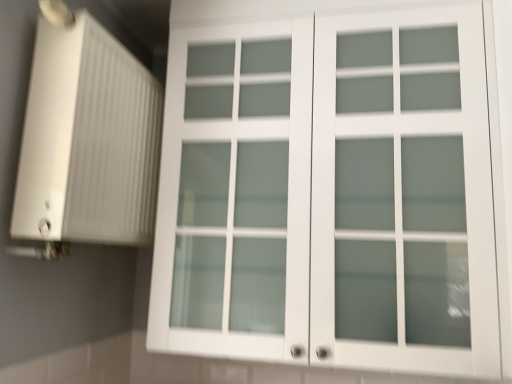
From the picture: What is the approximate width of white ribbed plastic at left?

6.20 inches.

Locate an element on the screen. white ribbed plastic at left is located at coordinates (88, 140).

The height and width of the screenshot is (384, 512). What do you see at coordinates (88, 140) in the screenshot?
I see `white ribbed plastic at left` at bounding box center [88, 140].

Image resolution: width=512 pixels, height=384 pixels. I want to click on white matte cabinet at upper center, so click(328, 186).

The height and width of the screenshot is (384, 512). What do you see at coordinates (328, 186) in the screenshot?
I see `white matte cabinet at upper center` at bounding box center [328, 186].

This screenshot has width=512, height=384. Identify the location of white ribbed plastic at left. (88, 140).

Which is more to the left, white ribbed plastic at left or white matte cabinet at upper center?

Positioned to the left is white ribbed plastic at left.

Between white ribbed plastic at left and white matte cabinet at upper center, which one is positioned behind?

white matte cabinet at upper center is further away from the camera.

Which is farther, [50,124] or [189,296]?

Positioned behind is point [189,296].

Looking at this image, from the image's perspective, which is above, white ribbed plastic at left or white matte cabinet at upper center?

white ribbed plastic at left appears higher in the image.

Looking at this image, from a real-world perspective, is white ribbed plastic at left positioned above or below white matte cabinet at upper center?

In terms of real-world spatial position, white ribbed plastic at left is above white matte cabinet at upper center.

Between white ribbed plastic at left and white matte cabinet at upper center, which one has larger width?

white matte cabinet at upper center is wider.

Is white ribbed plastic at left shorter than white matte cabinet at upper center?

Yes, white ribbed plastic at left is shorter than white matte cabinet at upper center.

Does white ribbed plastic at left have a larger size compared to white matte cabinet at upper center?

Actually, white ribbed plastic at left might be smaller than white matte cabinet at upper center.

Looking at this image, would you say white ribbed plastic at left contains white matte cabinet at upper center?

That's incorrect, white matte cabinet at upper center is not inside white ribbed plastic at left.

Would you consider white ribbed plastic at left to be distant from white matte cabinet at upper center?

white ribbed plastic at left is near white matte cabinet at upper center, not far away.

Consider the image. Is white ribbed plastic at left oriented towards white matte cabinet at upper center?

Yes.

Locate an element on the screen. The height and width of the screenshot is (384, 512). cupboard on the right of white ribbed plastic at left is located at coordinates (328, 186).

Does white matte cabinet at upper center appear on the right side of white ribbed plastic at left?

Indeed, white matte cabinet at upper center is positioned on the right side of white ribbed plastic at left.

From the picture: Considering their positions, is white matte cabinet at upper center located in front of or behind white ribbed plastic at left?

white matte cabinet at upper center is behind white ribbed plastic at left.

Is point (470, 292) closer to camera compared to point (140, 180)?

Yes, it is in front of point (140, 180).

From the image's perspective, would you say white matte cabinet at upper center is positioned over white ribbed plastic at left?

No, from the image's perspective, white matte cabinet at upper center is not over white ribbed plastic at left.

From a real-world perspective, who is located higher, white matte cabinet at upper center or white ribbed plastic at left?

In real-world perspective, white ribbed plastic at left is above.

Is white matte cabinet at upper center wider than white ribbed plastic at left?

Yes.

Considering the sizes of objects white matte cabinet at upper center and white ribbed plastic at left in the image provided, who is taller, white matte cabinet at upper center or white ribbed plastic at left?

white matte cabinet at upper center is taller.

From the picture: Can you confirm if white matte cabinet at upper center is smaller than white ribbed plastic at left?

Incorrect, white matte cabinet at upper center is not smaller in size than white ribbed plastic at left.

Is white matte cabinet at upper center positioned beyond the bounds of white ribbed plastic at left?

white matte cabinet at upper center is positioned outside white ribbed plastic at left.

Is white matte cabinet at upper center positioned far away from white ribbed plastic at left?

They are positioned close to each other.

Is white matte cabinet at upper center looking in the opposite direction of white ribbed plastic at left?

white matte cabinet at upper center does not have its back to white ribbed plastic at left.

What's the angular difference between white matte cabinet at upper center and white ribbed plastic at left's facing directions?

They differ by 88.3 degrees in their facing directions.

At what (x,y) coordinates should I click in order to perform the action: click on air conditioning above the white matte cabinet at upper center (from the image's perspective). Please return your answer as a coordinate pair (x, y). Looking at the image, I should click on (88, 140).

Locate an element on the screen. The image size is (512, 384). cupboard located underneath the white ribbed plastic at left (from a real-world perspective) is located at coordinates (328, 186).

The width and height of the screenshot is (512, 384). Identify the location of air conditioning lying on the left of white matte cabinet at upper center. (88, 140).